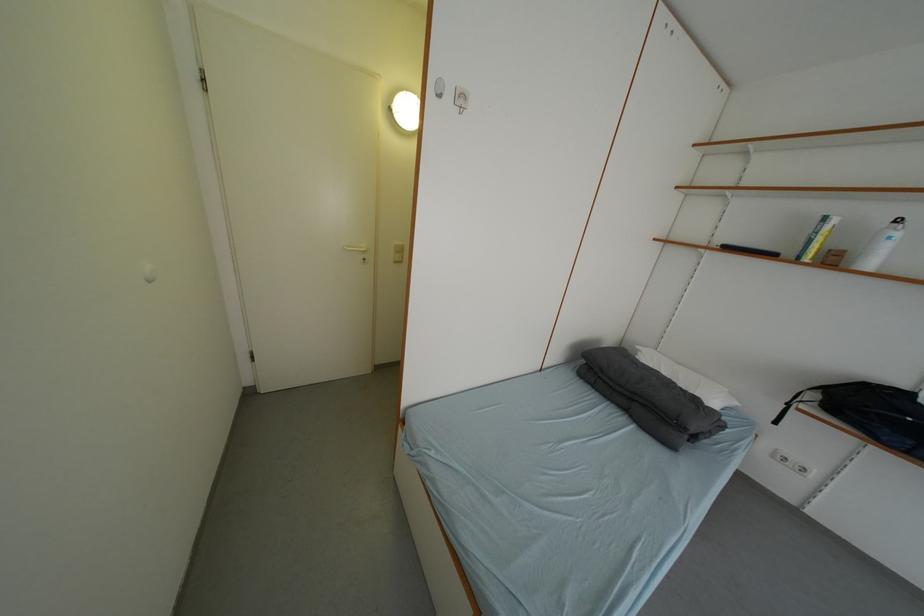
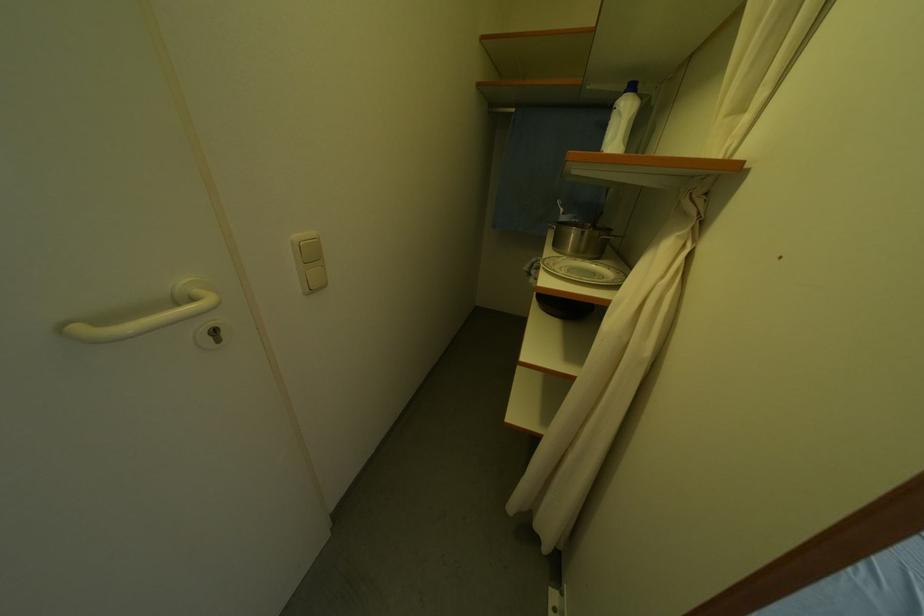
The point at (405, 246) is marked in the first image. Where is the corresponding point in the second image?

(306, 238)